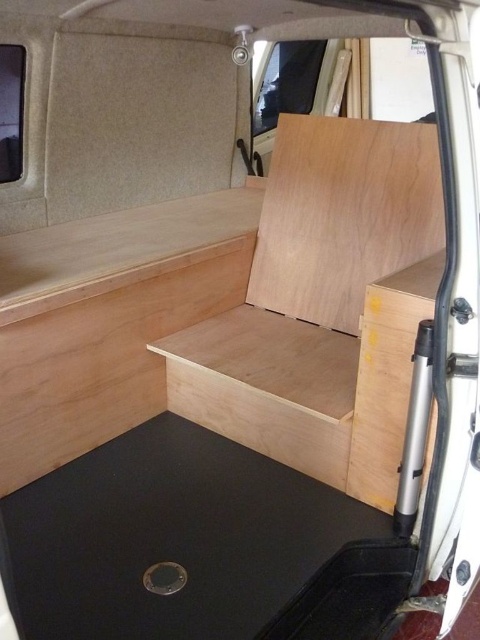
Is black rubber mat at lower left thinner than natural wood plywood at lower left?

No.

Between black rubber mat at lower left and natural wood plywood at lower left, which one has less height?

With less height is black rubber mat at lower left.

You are a GUI agent. You are given a task and a screenshot of the screen. Output one action in this format:
    pyautogui.click(x=<x>, y=<y>)
    Task: Click on the black rubber mat at lower left
    The image size is (480, 640).
    Given the screenshot: What is the action you would take?
    pyautogui.click(x=197, y=547)

This screenshot has width=480, height=640. I want to click on black rubber mat at lower left, so click(197, 547).

Does black rubber mat at lower left appear over natural wood plywood at center?

No, black rubber mat at lower left is not above natural wood plywood at center.

What do you see at coordinates (197, 547) in the screenshot? This screenshot has height=640, width=480. I see `black rubber mat at lower left` at bounding box center [197, 547].

Locate an element on the screen. black rubber mat at lower left is located at coordinates (197, 547).

Between natural wood plywood at lower left and natural wood plywood at center, which one has more height?

Standing taller between the two is natural wood plywood at lower left.

Can you confirm if natural wood plywood at lower left is wider than natural wood plywood at center?

Yes, natural wood plywood at lower left is wider than natural wood plywood at center.

Where is `natural wood plywood at lower left`? natural wood plywood at lower left is located at coordinates (101, 355).